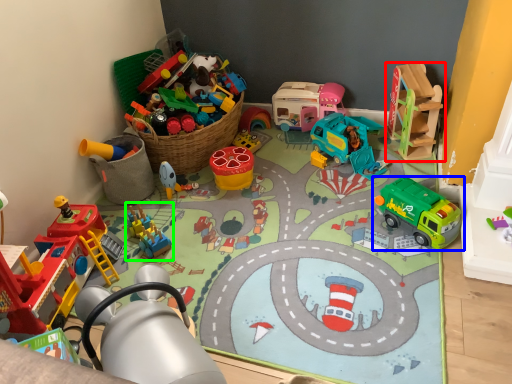
Question: Which object is positioned farthest from toy (highlighted by a red box)? Select from toy (highlighted by a blue box) and toy (highlighted by a green box).

Choices:
 (A) toy
 (B) toy

Answer: (B)